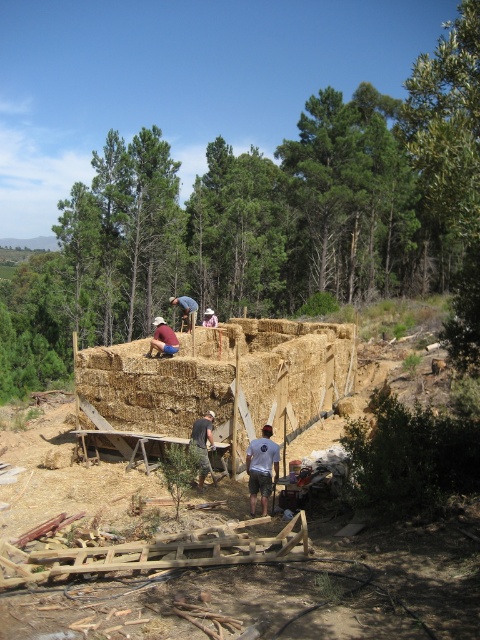
You are a photographer at the construction site and want to capture a photo of the dark gray fabric shirt at center and the blue denim shorts at center. Which clothing item is shorter in length?

The dark gray fabric shirt at center is shorter than blue denim shorts at center.

Consider the image. You are a photographer at the construction site. You notice the blue denim shorts at center and the brown straw hat at upper center. Which object is located lower in the image?

The blue denim shorts at center is positioned over the brown straw hat at upper center, meaning the brown straw hat at upper center is higher up and the blue denim shorts at center is lower.